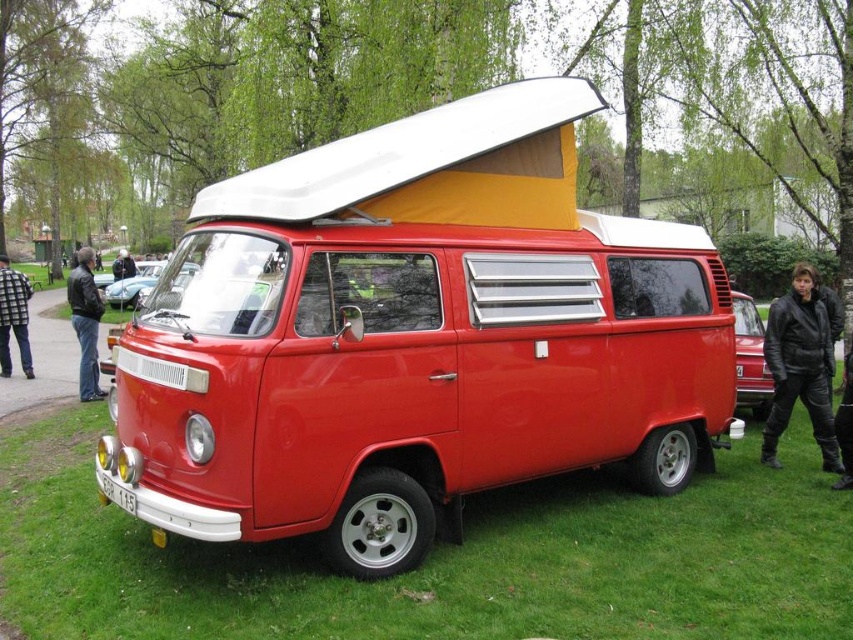
Does matte red van at center appear on the right side of shiny black car at right?

No, matte red van at center is not to the right of shiny black car at right.

Measure the distance from matte red van at center to shiny black car at right.

The distance of matte red van at center from shiny black car at right is 15.31 feet.

The width and height of the screenshot is (853, 640). I want to click on matte red van at center, so click(415, 337).

Who is more forward, (785, 355) or (91, 305)?

Positioned in front is point (785, 355).

Who is taller, black leather jacket at lower right or leather jacket at left?

leather jacket at left is taller.

Locate an element on the screen. This screenshot has height=640, width=853. black leather jacket at lower right is located at coordinates (799, 365).

Who is more forward, (809,273) or (143,285)?

Positioned in front is point (809,273).

What are the coordinates of `black leather jacket at lower right` in the screenshot? It's located at (799, 365).